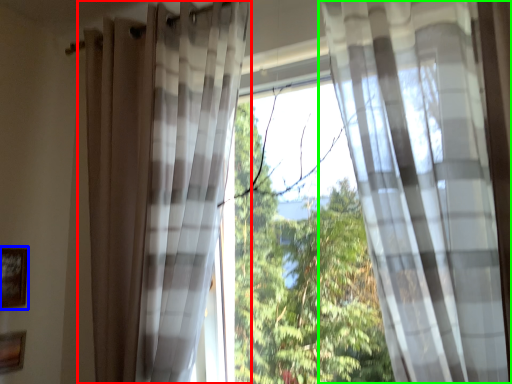
Question: Which object is the closest to the curtain (highlighted by a red box)? Choose among these: picture frame (highlighted by a blue box) or curtain (highlighted by a green box).

Choices:
 (A) picture frame
 (B) curtain

Answer: (B)